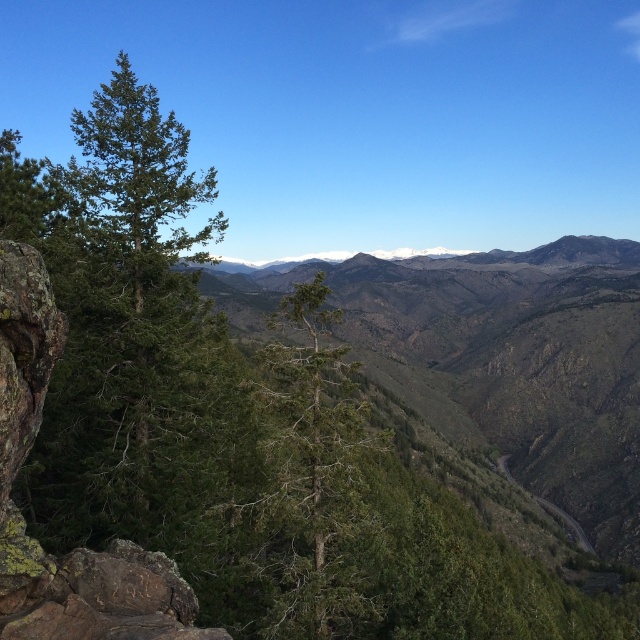
Question: Can you confirm if green matte tree at left is thinner than green textured tree at center?

Choices:
 (A) yes
 (B) no

Answer: (A)

Question: From the image, what is the correct spatial relationship of green matte tree at left in relation to green textured tree at center?

Choices:
 (A) below
 (B) above

Answer: (B)

Question: Considering the relative positions of green matte tree at left and green textured tree at center in the image provided, where is green matte tree at left located with respect to green textured tree at center?

Choices:
 (A) below
 (B) above

Answer: (B)

Question: Which point is closer to the camera?

Choices:
 (A) green matte tree at left
 (B) green textured tree at center

Answer: (B)